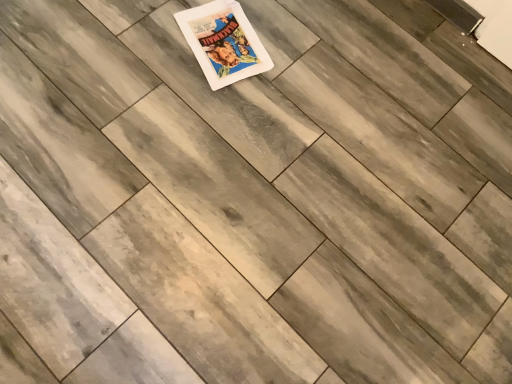
Locate an element on the screen. The width and height of the screenshot is (512, 384). vacant space to the left of matte white comic book at upper center is located at coordinates (142, 43).